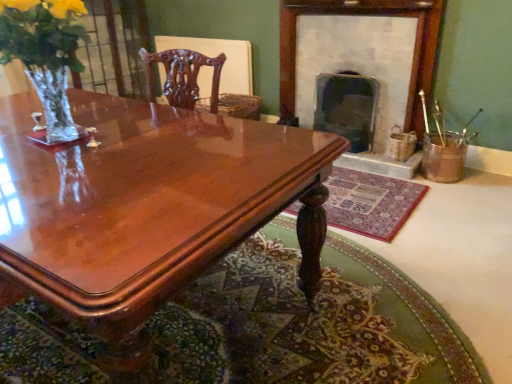
Image resolution: width=512 pixels, height=384 pixels. I want to click on vacant area on the back side of clear glass vase at left, so click(90, 115).